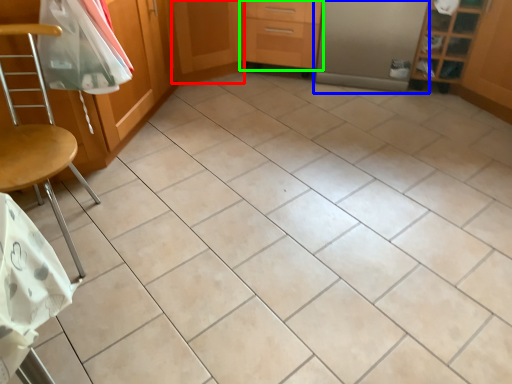
Question: Estimate the real-world distances between objects in this image. Which object is farther from screen door (highlighted by a red box), screen door (highlighted by a blue box) or drawer (highlighted by a green box)?

Choices:
 (A) screen door
 (B) drawer

Answer: (A)